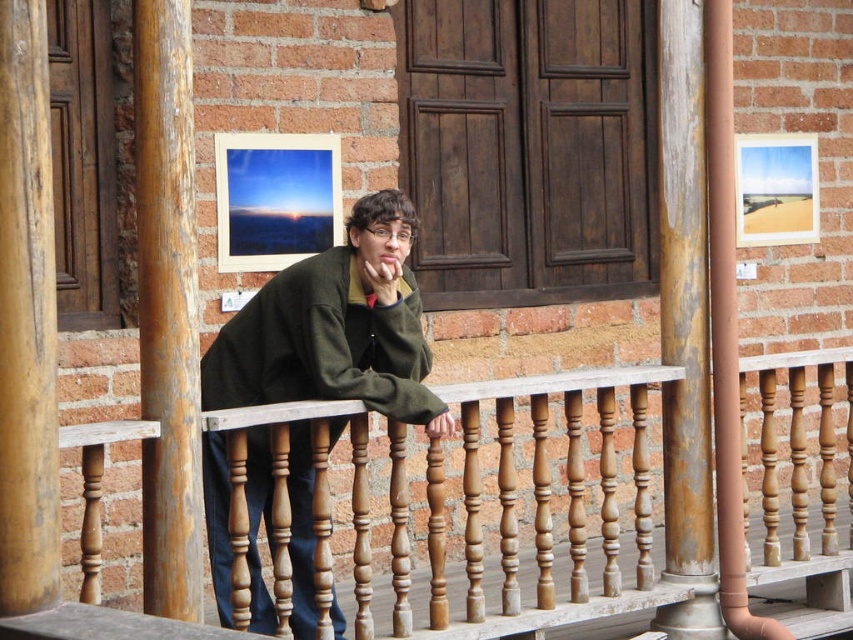
Based on the photo, does green matte jacket at center lie in front of green fleece jacket at center?

No, it is not.

Who is more distant from viewer, (281,310) or (415,330)?

The point (415,330) is behind.

This screenshot has width=853, height=640. What do you see at coordinates (334, 326) in the screenshot? I see `green matte jacket at center` at bounding box center [334, 326].

This screenshot has height=640, width=853. I want to click on green matte jacket at center, so click(x=334, y=326).

Between wooden at center and green matte jacket at center, which one is positioned lower?

wooden at center

Between point (764, 502) and point (345, 292), which one is positioned behind?

The point (764, 502) is more distant.

Is point (569, 564) more distant than point (305, 356)?

Yes, it is.

This screenshot has width=853, height=640. What are the coordinates of `wooden at center` in the screenshot? It's located at (479, 513).

Is green matte jacket at center in front of rusty wood post at center?

Yes.

From the picture: Who is positioned more to the right, green matte jacket at center or rusty wood post at center?

Positioned to the right is rusty wood post at center.

Where is `green matte jacket at center`? green matte jacket at center is located at coordinates (334, 326).

The height and width of the screenshot is (640, 853). Identify the location of green matte jacket at center. (334, 326).